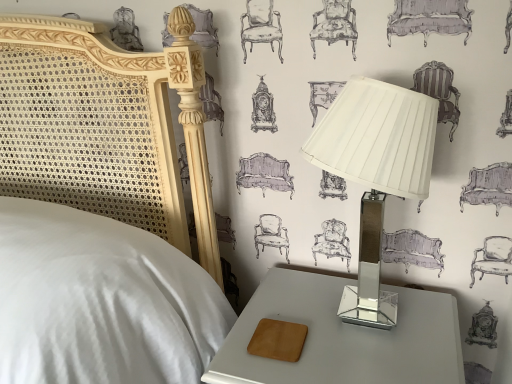
Locate an element on the screen. This screenshot has width=512, height=384. free space that is to the left of metallic silver lamp at right is located at coordinates (272, 324).